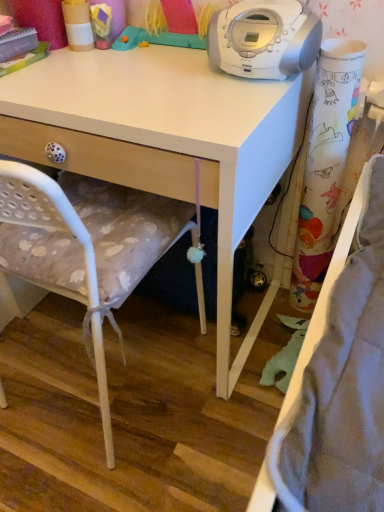
Question: Can you confirm if colorful paper curtain at right is wider than white matte desk at upper center?

Choices:
 (A) yes
 (B) no

Answer: (B)

Question: Is colorful paper curtain at right thinner than white matte desk at upper center?

Choices:
 (A) yes
 (B) no

Answer: (A)

Question: Considering the relative sizes of colorful paper curtain at right and white matte desk at upper center in the image provided, is colorful paper curtain at right taller than white matte desk at upper center?

Choices:
 (A) yes
 (B) no

Answer: (A)

Question: Is there a large distance between colorful paper curtain at right and white matte desk at upper center?

Choices:
 (A) no
 (B) yes

Answer: (A)

Question: Is colorful paper curtain at right oriented towards white matte desk at upper center?

Choices:
 (A) yes
 (B) no

Answer: (B)

Question: Is point (183, 133) closer or farther from the camera than point (31, 190)?

Choices:
 (A) farther
 (B) closer

Answer: (A)

Question: Is white matte desk at upper center to the left or to the right of white fabric chair at center in the image?

Choices:
 (A) left
 (B) right

Answer: (B)

Question: From their relative heights in the image, would you say white matte desk at upper center is taller or shorter than white fabric chair at center?

Choices:
 (A) tall
 (B) short

Answer: (B)

Question: From a real-world perspective, is white matte desk at upper center above or below white fabric chair at center?

Choices:
 (A) above
 (B) below

Answer: (B)

Question: From a real-world perspective, is colorful paper curtain at right positioned above or below white fabric chair at center?

Choices:
 (A) above
 (B) below

Answer: (A)

Question: Is colorful paper curtain at right to the left or to the right of white fabric chair at center in the image?

Choices:
 (A) right
 (B) left

Answer: (A)

Question: Do you think colorful paper curtain at right is within white fabric chair at center, or outside of it?

Choices:
 (A) inside
 (B) outside

Answer: (B)

Question: Is point (357, 51) closer or farther from the camera than point (23, 197)?

Choices:
 (A) closer
 (B) farther

Answer: (B)

Question: From the image's perspective, is white fabric chair at center located above or below colorful paper curtain at right?

Choices:
 (A) below
 (B) above

Answer: (A)

Question: Would you say white fabric chair at center is to the left or to the right of colorful paper curtain at right in the picture?

Choices:
 (A) right
 (B) left

Answer: (B)